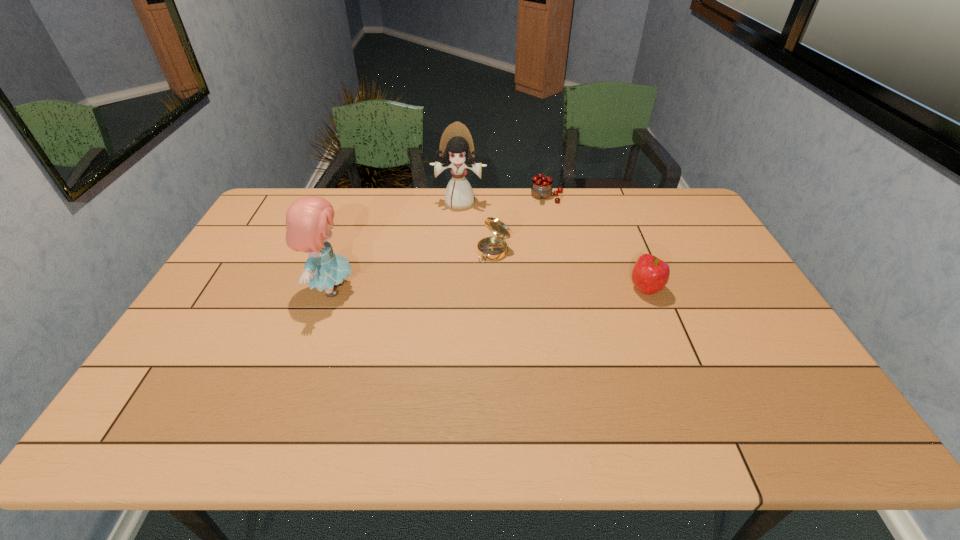
Locate an element on the screen. This screenshot has width=960, height=540. vacant space that satisfies the following two spatial constraints: 1. on the front side of the second object from right to left; 2. on the left side of the rightmost object is located at coordinates (565, 289).